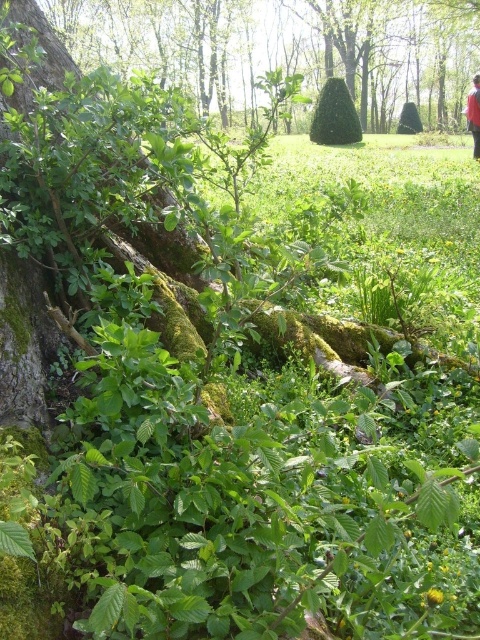
You are standing in the outdoor scene and want to walk from point A to point B. Point A is at coordinate point(253, 104) and point B is at coordinate point(476, 125). Which point is closer to you when you start walking?

Point A at coordinate point(253, 104) is closer to you than point B at coordinate point(476, 125) because it is further to the viewer.

You are standing in the outdoor scene and want to take a photo of the green mossy tree at upper left and the red fabric person at upper right. Which object is located to the left of the other?

The green mossy tree at upper left is positioned on the left side of red fabric person at upper right.